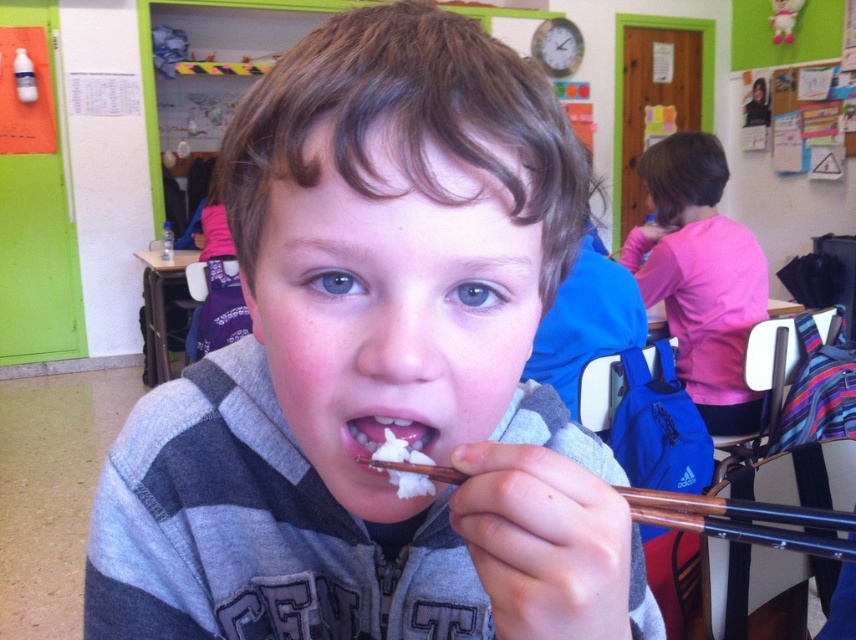
You are a student in the classroom. You see the white matte food at center and the white fluffy rice at mouth. Which one is taller?

The white matte food at center is taller than the white fluffy rice at mouth.